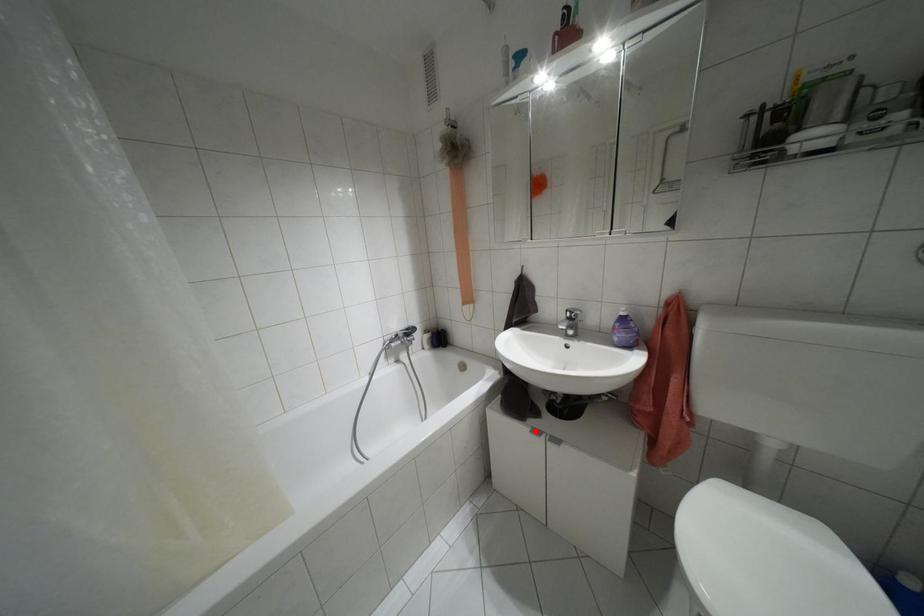
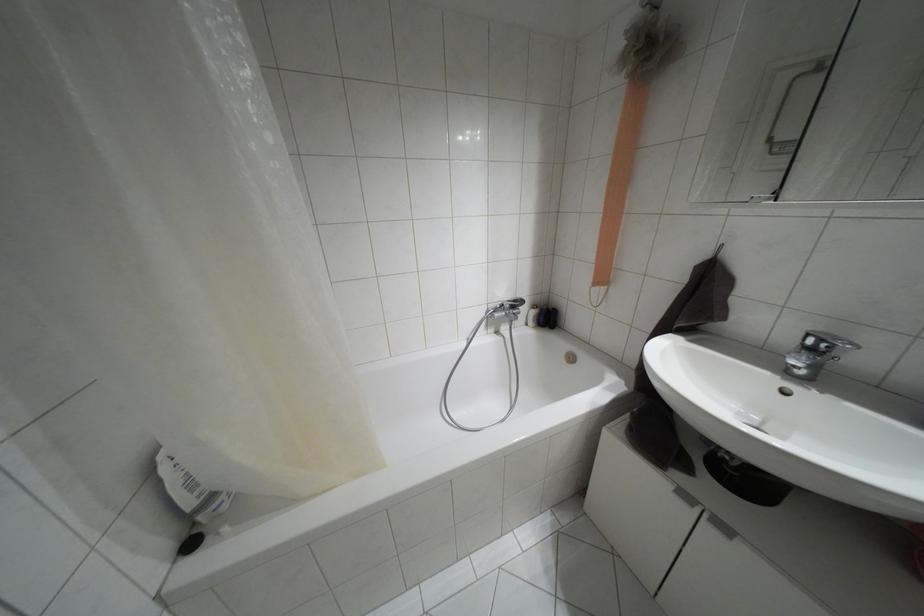
Where in the second image is the point corresponding to the highlighted location from the first image?

(685, 496)